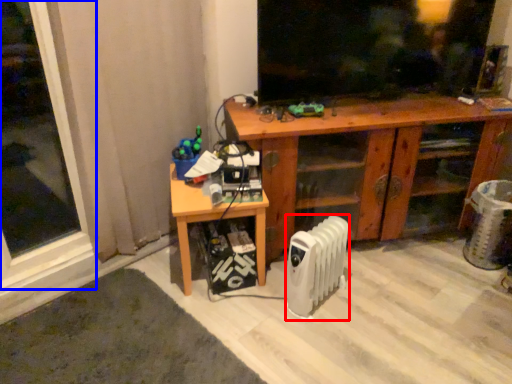
Question: Which point is closer to the camera, radiator (highlighted by a red box) or window (highlighted by a blue box)?

Choices:
 (A) radiator
 (B) window

Answer: (B)